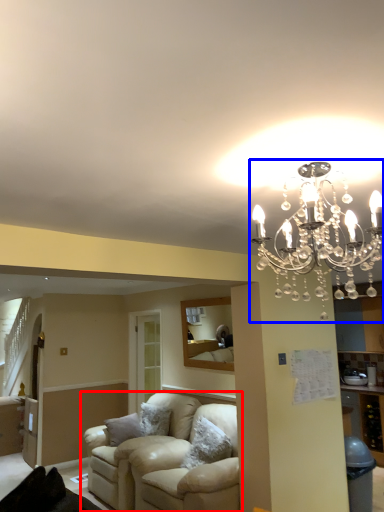
Question: Which object appears closest to the camera in this image, studio couch (highlighted by a red box) or lamp (highlighted by a blue box)?

Choices:
 (A) studio couch
 (B) lamp

Answer: (B)